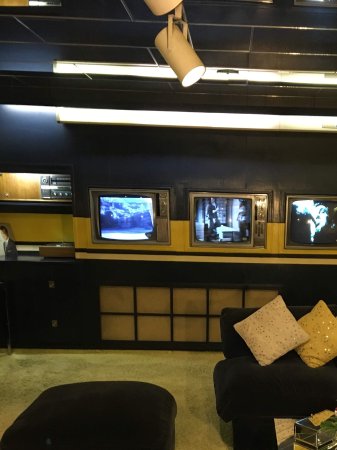
I want to click on tv screen, so click(x=128, y=218), click(x=224, y=220), click(x=318, y=223).